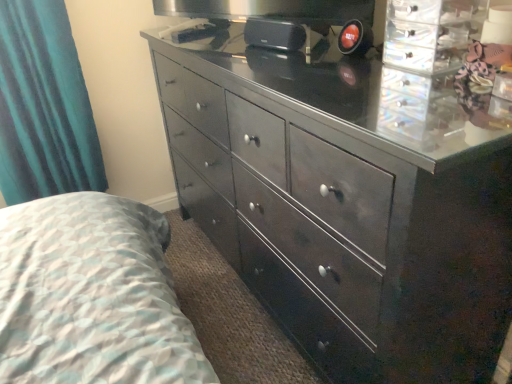
Question: Should I look upward or downward to see teal velvet curtain at left?

Choices:
 (A) up
 (B) down

Answer: (A)

Question: Is teal velvet curtain at left at the left side of glossy dark wood dresser at center?

Choices:
 (A) yes
 (B) no

Answer: (A)

Question: From a real-world perspective, does teal velvet curtain at left sit lower than glossy dark wood dresser at center?

Choices:
 (A) yes
 (B) no

Answer: (B)

Question: Is the position of teal velvet curtain at left less distant than that of glossy dark wood dresser at center?

Choices:
 (A) no
 (B) yes

Answer: (A)

Question: Would you say teal velvet curtain at left is outside glossy dark wood dresser at center?

Choices:
 (A) yes
 (B) no

Answer: (A)

Question: Is teal velvet curtain at left positioned behind glossy dark wood dresser at center?

Choices:
 (A) yes
 (B) no

Answer: (A)

Question: Is teal velvet curtain at left not near glossy dark wood dresser at center?

Choices:
 (A) yes
 (B) no

Answer: (B)

Question: Is the depth of glossy dark wood dresser at center greater than that of teal velvet curtain at left?

Choices:
 (A) no
 (B) yes

Answer: (A)

Question: From the image's perspective, is glossy dark wood dresser at center under teal velvet curtain at left?

Choices:
 (A) no
 (B) yes

Answer: (B)

Question: From a real-world perspective, is glossy dark wood dresser at center located beneath teal velvet curtain at left?

Choices:
 (A) yes
 (B) no

Answer: (A)

Question: Can you confirm if glossy dark wood dresser at center is positioned to the right of teal velvet curtain at left?

Choices:
 (A) no
 (B) yes

Answer: (B)

Question: Does glossy dark wood dresser at center appear on the left side of teal velvet curtain at left?

Choices:
 (A) no
 (B) yes

Answer: (A)

Question: Is the depth of glossy dark wood dresser at center less than that of teal velvet curtain at left?

Choices:
 (A) no
 (B) yes

Answer: (B)

Question: From the image's perspective, is glossy dark wood dresser at center positioned above or below teal velvet curtain at left?

Choices:
 (A) above
 (B) below

Answer: (B)